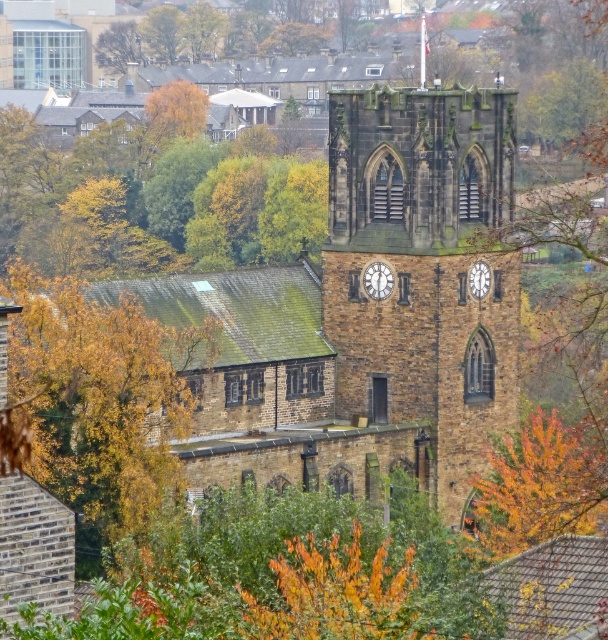
You are standing in front of the historic stone church with its clock tower. You notice autumn leaves at center. Based on their position, can you determine if they are closer to the church or the residential buildings in the background?

The autumn leaves at center are located at point (539, 484), which places them closer to the church than the residential buildings in the background.

You are standing in front of the historic stone church with a clock tower. You want to take a photo of the clock tower without any obstructions. There is a golden leafy tree at center in the way. Where should you move to get a clear view of the clock tower?

Move to the left or right of the golden leafy tree at center to avoid its obstruction and get a clear view of the clock tower.